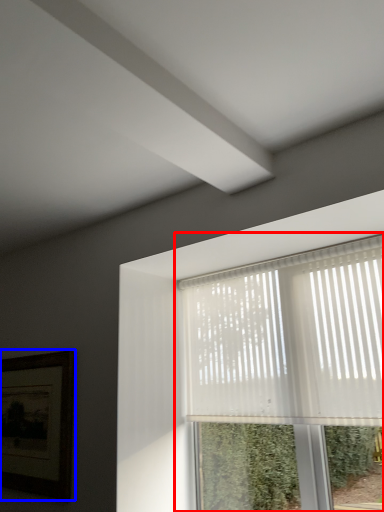
Question: Which point is closer to the camera, window (highlighted by a red box) or picture frame (highlighted by a blue box)?

Choices:
 (A) window
 (B) picture frame

Answer: (A)